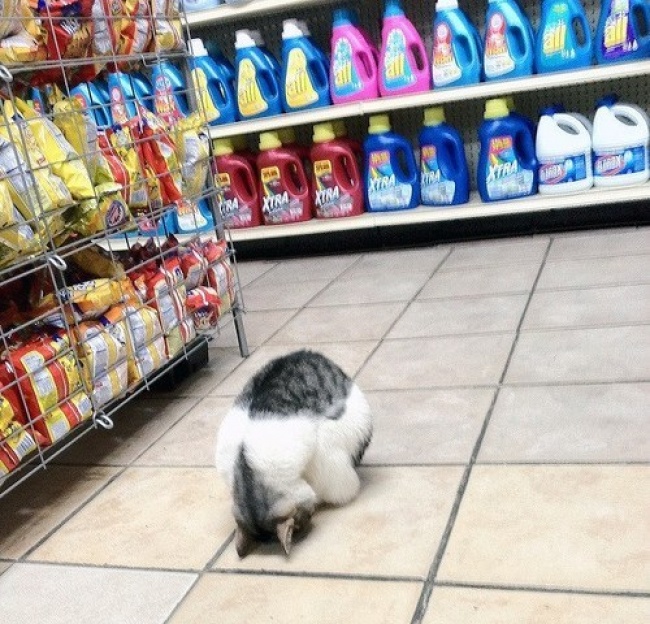
Identify the location of tile. (439, 376).